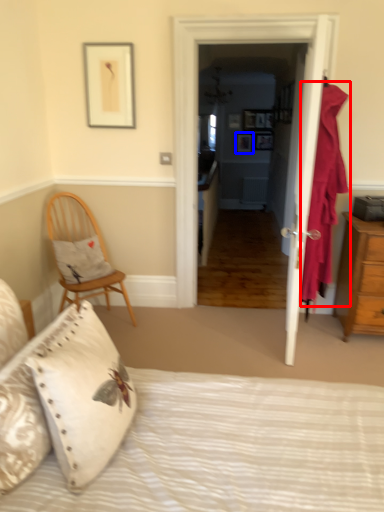
Question: Among these objects, which one is farthest to the camera, curtain (highlighted by a red box) or picture frame (highlighted by a blue box)?

Choices:
 (A) curtain
 (B) picture frame

Answer: (B)